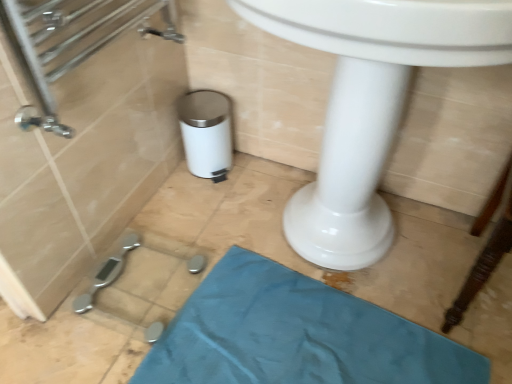
The image size is (512, 384). In order to click on white glossy sink at center in this screenshot , I will do `click(370, 103)`.

Image resolution: width=512 pixels, height=384 pixels. What do you see at coordinates (370, 103) in the screenshot? I see `white glossy sink at center` at bounding box center [370, 103].

The width and height of the screenshot is (512, 384). What do you see at coordinates (296, 335) in the screenshot?
I see `teal fabric bath mat at lower center` at bounding box center [296, 335].

Find the location of a particular element. teal fabric bath mat at lower center is located at coordinates (296, 335).

Measure the distance between teal fabric bath mat at lower center and camera.

A distance of 3.39 feet exists between teal fabric bath mat at lower center and camera.

The width and height of the screenshot is (512, 384). I want to click on white glossy sink at center, so click(x=370, y=103).

Which is more to the left, teal fabric bath mat at lower center or white glossy sink at center?

Positioned to the left is teal fabric bath mat at lower center.

Considering the positions of objects teal fabric bath mat at lower center and white glossy sink at center in the image provided, who is in front, teal fabric bath mat at lower center or white glossy sink at center?

Positioned in front is white glossy sink at center.

Is point (457, 352) farther from viewer compared to point (499, 38)?

Yes, point (457, 352) is farther from viewer.

From the image's perspective, which one is positioned lower, teal fabric bath mat at lower center or white glossy sink at center?

teal fabric bath mat at lower center, from the image's perspective.

From a real-world perspective, relative to white glossy sink at center, is teal fabric bath mat at lower center vertically above or below?

teal fabric bath mat at lower center is situated lower than white glossy sink at center in the real world.

Is teal fabric bath mat at lower center wider than white glossy sink at center?

No, teal fabric bath mat at lower center is not wider than white glossy sink at center.

From their relative heights in the image, would you say teal fabric bath mat at lower center is taller or shorter than white glossy sink at center?

teal fabric bath mat at lower center is shorter than white glossy sink at center.

Considering the relative sizes of teal fabric bath mat at lower center and white glossy sink at center in the image provided, is teal fabric bath mat at lower center smaller than white glossy sink at center?

Correct, teal fabric bath mat at lower center occupies less space than white glossy sink at center.

Is teal fabric bath mat at lower center not within white glossy sink at center?

That's correct, teal fabric bath mat at lower center is outside of white glossy sink at center.

Can you see teal fabric bath mat at lower center touching white glossy sink at center?

teal fabric bath mat at lower center is not next to white glossy sink at center, and they're not touching.

Is teal fabric bath mat at lower center aimed at white glossy sink at center?

No, teal fabric bath mat at lower center is not facing towards white glossy sink at center.

Based on the photo, what's the angular difference between teal fabric bath mat at lower center and white glossy sink at center's facing directions?

The angular difference between teal fabric bath mat at lower center and white glossy sink at center is 3.65 degrees.

Locate an element on the screen. bath mat behind the white glossy sink at center is located at coordinates (296, 335).

Considering the positions of objects white glossy sink at center and teal fabric bath mat at lower center in the image provided, who is more to the left, white glossy sink at center or teal fabric bath mat at lower center?

teal fabric bath mat at lower center is more to the left.

Which object is closer to the camera taking this photo, white glossy sink at center or teal fabric bath mat at lower center?

white glossy sink at center is closer to the camera.

Does point (398, 52) come in front of point (175, 374)?

Yes, point (398, 52) is closer to viewer.

From the image's perspective, which is below, white glossy sink at center or teal fabric bath mat at lower center?

From the image's view, teal fabric bath mat at lower center is below.

From a real-world perspective, which is physically below, white glossy sink at center or teal fabric bath mat at lower center?

teal fabric bath mat at lower center.

Which of these two, white glossy sink at center or teal fabric bath mat at lower center, is wider?

Wider between the two is white glossy sink at center.

Which of these two, white glossy sink at center or teal fabric bath mat at lower center, stands taller?

Standing taller between the two is white glossy sink at center.

Is white glossy sink at center bigger than teal fabric bath mat at lower center?

Yes, white glossy sink at center is bigger than teal fabric bath mat at lower center.

Could teal fabric bath mat at lower center be considered to be inside white glossy sink at center?

No, teal fabric bath mat at lower center is not inside white glossy sink at center.

Is white glossy sink at center positioned far away from teal fabric bath mat at lower center?

That's not correct — white glossy sink at center is a little close to teal fabric bath mat at lower center.

Is white glossy sink at center positioned with its back to teal fabric bath mat at lower center?

white glossy sink at center is not turned away from teal fabric bath mat at lower center.

From the picture: How different are the orientations of white glossy sink at center and teal fabric bath mat at lower center in degrees?

3.65 degrees separate the facing orientations of white glossy sink at center and teal fabric bath mat at lower center.

Identify the location of sink in front of the teal fabric bath mat at lower center. This screenshot has height=384, width=512. (370, 103).

This screenshot has width=512, height=384. What are the coordinates of `bath mat below the white glossy sink at center (from the image's perspective)` in the screenshot? It's located at coord(296,335).

Identify the location of bath mat on the left of white glossy sink at center. The height and width of the screenshot is (384, 512). (296, 335).